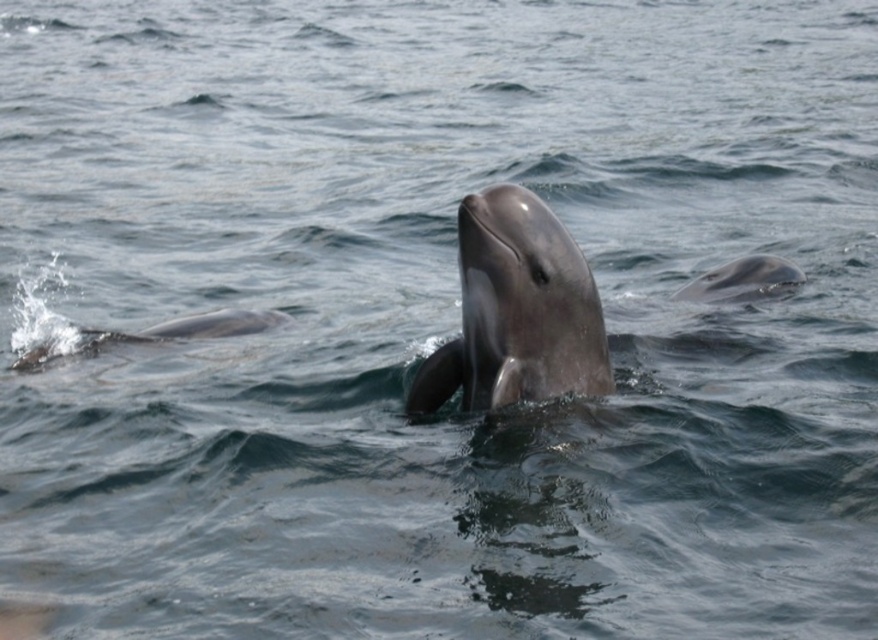
Question: Which of the following is the farthest from the observer?

Choices:
 (A) smooth gray dolphin at center
 (B) gray smooth dolphin at left
 (C) gray smooth dolphin at upper right

Answer: (C)

Question: Does smooth gray dolphin at center appear under gray smooth dolphin at upper right?

Choices:
 (A) no
 (B) yes

Answer: (B)

Question: Can you confirm if smooth gray dolphin at center is positioned to the left of gray smooth dolphin at upper right?

Choices:
 (A) yes
 (B) no

Answer: (A)

Question: Which point appears farthest from the camera in this image?

Choices:
 (A) (576, 292)
 (B) (753, 259)

Answer: (B)

Question: Considering the real-world distances, which object is closest to the gray smooth dolphin at upper right?

Choices:
 (A) smooth gray dolphin at center
 (B) gray smooth dolphin at left

Answer: (A)

Question: Is the position of gray smooth dolphin at left less distant than that of gray smooth dolphin at upper right?

Choices:
 (A) no
 (B) yes

Answer: (B)